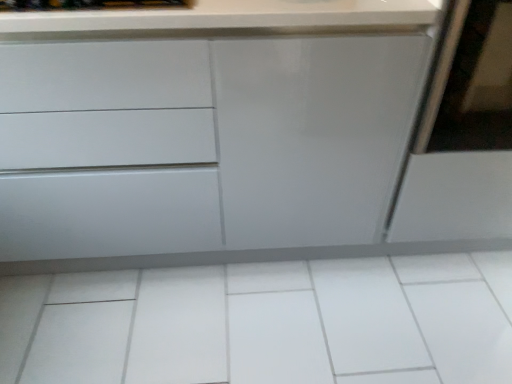
Question: Can you confirm if matte white cabinet at center is smaller than white glossy tile at center?

Choices:
 (A) yes
 (B) no

Answer: (B)

Question: Can you confirm if matte white cabinet at center is wider than white glossy tile at center?

Choices:
 (A) no
 (B) yes

Answer: (A)

Question: Could you tell me if matte white cabinet at center is facing white glossy tile at center?

Choices:
 (A) yes
 (B) no

Answer: (B)

Question: From the image's perspective, is matte white cabinet at center over white glossy tile at center?

Choices:
 (A) yes
 (B) no

Answer: (A)

Question: From the image's perspective, is matte white cabinet at center located beneath white glossy tile at center?

Choices:
 (A) no
 (B) yes

Answer: (A)

Question: Based on their sizes in the image, would you say matte white screen door at right is bigger or smaller than matte white cabinet at center?

Choices:
 (A) big
 (B) small

Answer: (B)

Question: From the image's perspective, is matte white screen door at right positioned above or below matte white cabinet at center?

Choices:
 (A) below
 (B) above

Answer: (B)

Question: Is point (505, 185) closer or farther from the camera than point (123, 66)?

Choices:
 (A) closer
 (B) farther

Answer: (B)

Question: Looking at their shapes, would you say matte white screen door at right is wider or thinner than matte white cabinet at center?

Choices:
 (A) thin
 (B) wide

Answer: (B)

Question: Is matte white cabinet at center situated inside matte white screen door at right or outside?

Choices:
 (A) inside
 (B) outside

Answer: (B)

Question: Would you say matte white cabinet at center is to the left or to the right of matte white screen door at right in the picture?

Choices:
 (A) right
 (B) left

Answer: (B)

Question: Considering the positions of point (287, 61) and point (498, 211), is point (287, 61) closer or farther from the camera than point (498, 211)?

Choices:
 (A) closer
 (B) farther

Answer: (A)

Question: From a real-world perspective, is matte white cabinet at center physically located above or below matte white screen door at right?

Choices:
 (A) below
 (B) above

Answer: (A)

Question: From the image's perspective, relative to white glossy tile at center, is matte white cabinet at center above or below?

Choices:
 (A) below
 (B) above

Answer: (B)

Question: Is matte white cabinet at center wider or thinner than white glossy tile at center?

Choices:
 (A) thin
 (B) wide

Answer: (A)